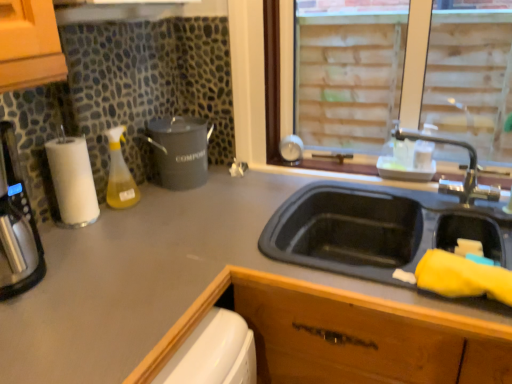
What do you see at coordinates (180, 151) in the screenshot?
I see `matte black compost bin at center-left` at bounding box center [180, 151].

Measure the distance between point [71,158] and camera.

1.15 meters.

Image resolution: width=512 pixels, height=384 pixels. Describe the element at coordinates (119, 174) in the screenshot. I see `translucent yellow liquid at bottle left` at that location.

This screenshot has width=512, height=384. I want to click on matte black compost bin at center-left, so tap(180, 151).

From a real-world perspective, is matte black compost bin at center-left above or below brass metallic faucet at upper right?

Clearly, from a real-world perspective, matte black compost bin at center-left is below brass metallic faucet at upper right.

Are matte black compost bin at center-left and brass metallic faucet at upper right far apart?

No, there isn't a large distance between matte black compost bin at center-left and brass metallic faucet at upper right.

Considering the relative sizes of matte black compost bin at center-left and brass metallic faucet at upper right in the image provided, is matte black compost bin at center-left smaller than brass metallic faucet at upper right?

Yes.

From the image's perspective, would you say matte black compost bin at center-left is positioned over brass metallic faucet at upper right?

Yes.

From the image's perspective, relative to translucent yellow liquid at bottle left, is matte gray countertop at center above or below?

matte gray countertop at center is below translucent yellow liquid at bottle left.

What's the angular difference between matte gray countertop at center and translucent yellow liquid at bottle left's facing directions?

matte gray countertop at center and translucent yellow liquid at bottle left are facing 90 degrees away from each other.

Considering the sizes of objects matte gray countertop at center and translucent yellow liquid at bottle left in the image provided, who is bigger, matte gray countertop at center or translucent yellow liquid at bottle left?

matte gray countertop at center is bigger.

From a real-world perspective, does matte gray countertop at center stand above translucent yellow liquid at bottle left?

No, from a real-world perspective, matte gray countertop at center is not on top of translucent yellow liquid at bottle left.

Is the position of translucent yellow liquid at bottle left more distant than that of matte black compost bin at center-left?

No, the depth of translucent yellow liquid at bottle left is less than that of matte black compost bin at center-left.

Which is further, (109,135) or (170,169)?

The point (170,169) is farther from the camera.

Is translucent yellow liquid at bottle left turned away from matte black compost bin at center-left?

That's not correct — translucent yellow liquid at bottle left is not looking away from matte black compost bin at center-left.

Considering the relative sizes of translucent yellow liquid at bottle left and matte black compost bin at center-left in the image provided, is translucent yellow liquid at bottle left smaller than matte black compost bin at center-left?

Correct, translucent yellow liquid at bottle left occupies less space than matte black compost bin at center-left.

Is matte black compost bin at center-left at the back of white paper towel at left?

white paper towel at left does not have its back to matte black compost bin at center-left.

Considering the relative sizes of white paper towel at left and matte black compost bin at center-left in the image provided, is white paper towel at left shorter than matte black compost bin at center-left?

In fact, white paper towel at left may be taller than matte black compost bin at center-left.

What's the angular difference between white paper towel at left and matte black compost bin at center-left's facing directions?

The facing directions of white paper towel at left and matte black compost bin at center-left are 0.00206 degrees apart.

Does white paper towel at left have a lesser width compared to matte black compost bin at center-left?

Indeed, white paper towel at left has a lesser width compared to matte black compost bin at center-left.

Is white paper towel at left bigger than translucent yellow liquid at bottle left?

Yes, white paper towel at left is bigger than translucent yellow liquid at bottle left.

Between point (83, 151) and point (114, 173), which one is positioned behind?

The point (114, 173) is more distant.

Would you say translucent yellow liquid at bottle left is part of white paper towel at left's contents?

That's incorrect, translucent yellow liquid at bottle left is not inside white paper towel at left.

Locate an element on the screen. bottle beneath the white paper towel at left (from a real-world perspective) is located at coordinates (119, 174).

In the scene shown: From the image's perspective, between white paper towel at left and brass metallic faucet at upper right, who is located below?

From the image's view, white paper towel at left is below.

Is white paper towel at left further to the viewer compared to brass metallic faucet at upper right?

→ Yes, white paper towel at left is further from the camera.

Find the location of `paper towel that appears below the brass metallic faucet at upper right (from the image's perspective)`. paper towel that appears below the brass metallic faucet at upper right (from the image's perspective) is located at coordinates (72, 180).

Considering the positions of point (60, 143) and point (471, 201), is point (60, 143) closer or farther from the camera than point (471, 201)?

Point (60, 143).

Are matte black compost bin at center-left and white paper towel at left making contact?

matte black compost bin at center-left is not next to white paper towel at left, and they're not touching.

Is matte black compost bin at center-left situated inside white paper towel at left or outside?

matte black compost bin at center-left is outside white paper towel at left.

From a real-world perspective, is matte black compost bin at center-left positioned under white paper towel at left based on gravity?

Yes.

Does point (166, 175) come behind point (71, 183)?

That is True.

You are a GUI agent. You are given a task and a screenshot of the screen. Output one action in this format:
    pyautogui.click(x=<x>, y=<y>)
    Task: Click on the tap in front of the matte black compost bin at center-left
    The height and width of the screenshot is (384, 512).
    Given the screenshot: What is the action you would take?
    pyautogui.click(x=465, y=168)

At what (x,y) coordinates should I click in order to perform the action: click on countertop on the right of translucent yellow liquid at bottle left. Please return your answer as a coordinate pair (x, y). Looking at the image, I should click on (150, 278).

From the image, which object appears to be farther from matte black compost bin at center-left, brass metallic faucet at upper right or white paper towel at left?

brass metallic faucet at upper right is further to matte black compost bin at center-left.

Based on their spatial positions, is white paper towel at left or brass metallic faucet at upper right further from matte black compost bin at center-left?

brass metallic faucet at upper right lies further to matte black compost bin at center-left than the other object.

From the picture: Estimate the real-world distances between objects in this image. Which object is further from translucent yellow liquid at bottle left, matte black compost bin at center-left or matte gray countertop at center?

matte gray countertop at center.

Estimate the real-world distances between objects in this image. Which object is closer to matte black compost bin at center-left, translucent yellow liquid at bottle left or matte gray countertop at center?

translucent yellow liquid at bottle left is positioned closer to the anchor matte black compost bin at center-left.

Consider the image. When comparing their distances from white paper towel at left, does translucent yellow liquid at bottle left or matte gray countertop at center seem further?

matte gray countertop at center.

Estimate the real-world distances between objects in this image. Which object is closer to white paper towel at left, matte black compost bin at center-left or brass metallic faucet at upper right?

matte black compost bin at center-left lies closer to white paper towel at left than the other object.

Based on their spatial positions, is translucent yellow liquid at bottle left or brass metallic faucet at upper right further from white paper towel at left?

brass metallic faucet at upper right lies further to white paper towel at left than the other object.

Looking at the image, which one is located closer to brass metallic faucet at upper right, translucent yellow liquid at bottle left or matte black compost bin at center-left?

matte black compost bin at center-left.

Find the location of a particular element. The height and width of the screenshot is (384, 512). appliance located between translucent yellow liquid at bottle left and brass metallic faucet at upper right in the left-right direction is located at coordinates (180, 151).

At what (x,y) coordinates should I click in order to perform the action: click on bottle situated between white paper towel at left and brass metallic faucet at upper right from left to right. Please return your answer as a coordinate pair (x, y). The image size is (512, 384). Looking at the image, I should click on (119, 174).

Where is `countertop between translucent yellow liquid at bottle left and brass metallic faucet at upper right in the horizontal direction`? The height and width of the screenshot is (384, 512). countertop between translucent yellow liquid at bottle left and brass metallic faucet at upper right in the horizontal direction is located at coordinates point(150,278).

What are the coordinates of `appliance between white paper towel at left and brass metallic faucet at upper right from left to right` in the screenshot? It's located at [180, 151].